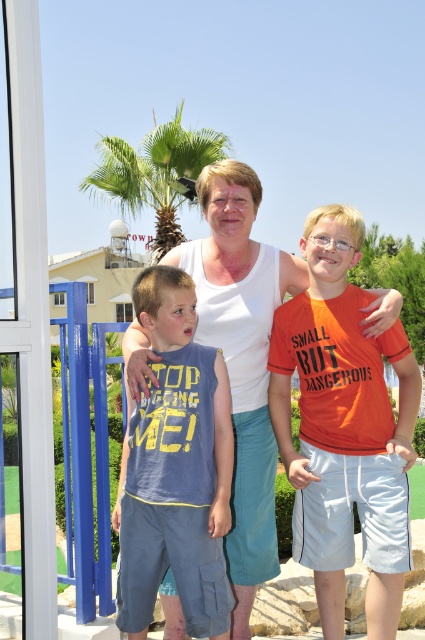
Is white fabric at center above green leafy palm tree at upper center?

Actually, white fabric at center is below green leafy palm tree at upper center.

Who is shorter, white fabric at center or green leafy palm tree at upper center?

white fabric at center

You are a GUI agent. You are given a task and a screenshot of the screen. Output one action in this format:
    pyautogui.click(x=<x>, y=<y>)
    Task: Click on the white fabric at center
    This screenshot has height=640, width=425.
    Given the screenshot: What is the action you would take?
    pyautogui.click(x=241, y=356)

Is orange cotton t-shirt at center to the right of green leafy palm tree at upper center from the viewer's perspective?

Correct, you'll find orange cotton t-shirt at center to the right of green leafy palm tree at upper center.

Which of these two, orange cotton t-shirt at center or green leafy palm tree at upper center, stands shorter?

orange cotton t-shirt at center

Image resolution: width=425 pixels, height=640 pixels. I want to click on orange cotton t-shirt at center, so click(x=343, y=428).

Does orange cotton t-shirt at center lie behind white fabric at center?

No, orange cotton t-shirt at center is in front of white fabric at center.

Does orange cotton t-shirt at center have a larger size compared to white fabric at center?

Correct, orange cotton t-shirt at center is larger in size than white fabric at center.

You are a GUI agent. You are given a task and a screenshot of the screen. Output one action in this format:
    pyautogui.click(x=<x>, y=<y>)
    Task: Click on the orange cotton t-shirt at center
    
    Given the screenshot: What is the action you would take?
    pyautogui.click(x=343, y=428)

Where is `orange cotton t-shirt at center`? orange cotton t-shirt at center is located at coordinates (343, 428).